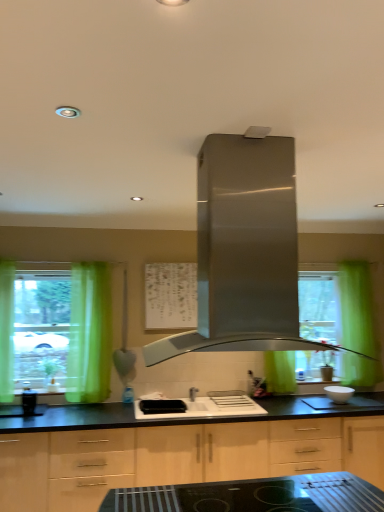
Question: From the image's perspective, is light wood cabinet at center below green fabric curtain at left?

Choices:
 (A) yes
 (B) no

Answer: (A)

Question: Considering the relative sizes of light wood cabinet at center and green fabric curtain at left in the image provided, is light wood cabinet at center taller than green fabric curtain at left?

Choices:
 (A) yes
 (B) no

Answer: (B)

Question: Is light wood cabinet at center turned away from green fabric curtain at left?

Choices:
 (A) no
 (B) yes

Answer: (A)

Question: Is light wood cabinet at center shorter than green fabric curtain at left?

Choices:
 (A) no
 (B) yes

Answer: (B)

Question: Considering the relative positions of light wood cabinet at center and green fabric curtain at left in the image provided, is light wood cabinet at center behind green fabric curtain at left?

Choices:
 (A) no
 (B) yes

Answer: (A)

Question: Considering the positions of green fabric curtain at left and light wood cabinet at center in the image, is green fabric curtain at left wider or thinner than light wood cabinet at center?

Choices:
 (A) thin
 (B) wide

Answer: (A)

Question: From the image's perspective, relative to light wood cabinet at center, is green fabric curtain at left above or below?

Choices:
 (A) below
 (B) above

Answer: (B)

Question: Is green fabric curtain at left bigger or smaller than light wood cabinet at center?

Choices:
 (A) small
 (B) big

Answer: (A)

Question: From a real-world perspective, is green fabric curtain at left above or below light wood cabinet at center?

Choices:
 (A) above
 (B) below

Answer: (A)

Question: From the image's perspective, relative to black glossy coffee maker at left, is stainless steel range hood at center above or below?

Choices:
 (A) below
 (B) above

Answer: (B)

Question: From a real-world perspective, is stainless steel range hood at center positioned above or below black glossy coffee maker at left?

Choices:
 (A) above
 (B) below

Answer: (A)

Question: Is stainless steel range hood at center taller or shorter than black glossy coffee maker at left?

Choices:
 (A) short
 (B) tall

Answer: (B)

Question: Considering their positions, is stainless steel range hood at center located in front of or behind black glossy coffee maker at left?

Choices:
 (A) behind
 (B) front

Answer: (B)

Question: Considering the positions of light wood cabinet at center and stainless steel range hood at center in the image, is light wood cabinet at center taller or shorter than stainless steel range hood at center?

Choices:
 (A) short
 (B) tall

Answer: (B)

Question: Is light wood cabinet at center in front of or behind stainless steel range hood at center in the image?

Choices:
 (A) front
 (B) behind

Answer: (B)